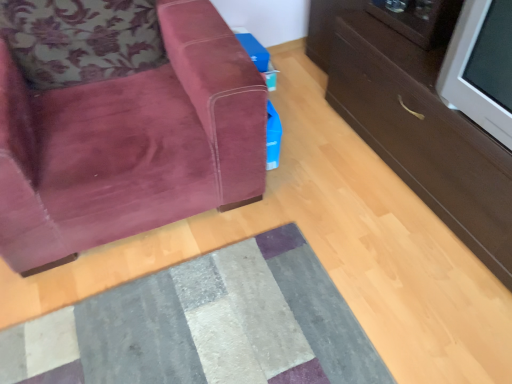
Question: From a real-world perspective, is velvet maroon armchair at left physically located above or below textured gray rug at center?

Choices:
 (A) below
 (B) above

Answer: (B)

Question: In the image, is velvet maroon armchair at left positioned in front of or behind textured gray rug at center?

Choices:
 (A) front
 (B) behind

Answer: (A)

Question: In terms of size, does velvet maroon armchair at left appear bigger or smaller than textured gray rug at center?

Choices:
 (A) big
 (B) small

Answer: (A)

Question: From the image's perspective, is textured gray rug at center located above or below velvet maroon armchair at left?

Choices:
 (A) above
 (B) below

Answer: (B)

Question: Considering the positions of point (231, 271) and point (183, 109), is point (231, 271) closer or farther from the camera than point (183, 109)?

Choices:
 (A) closer
 (B) farther

Answer: (A)

Question: Is textured gray rug at center bigger or smaller than velvet maroon armchair at left?

Choices:
 (A) big
 (B) small

Answer: (B)

Question: Choose the correct answer: Is textured gray rug at center inside velvet maroon armchair at left or outside it?

Choices:
 (A) inside
 (B) outside

Answer: (B)